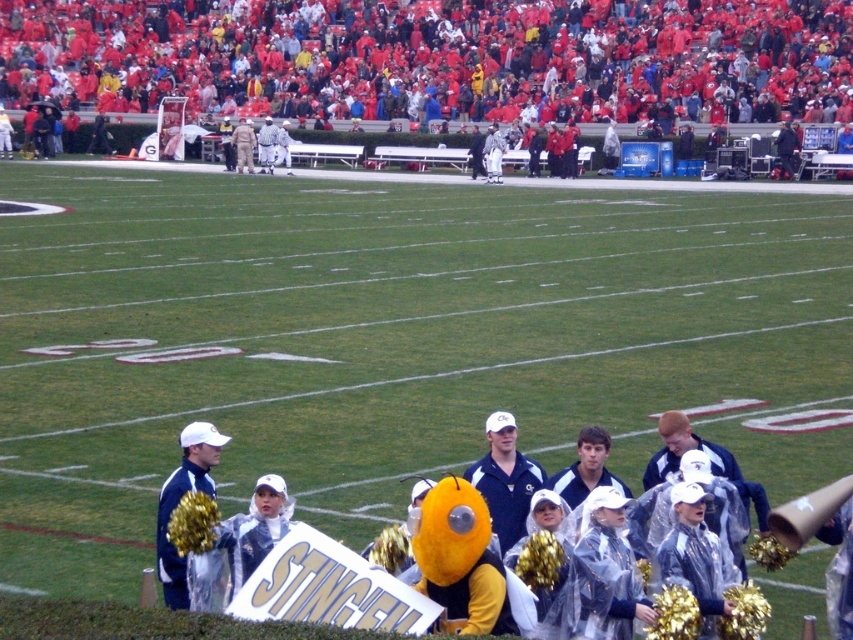
You are an event organizer planning to place a large banner between the red fabric crowd at upper center and the blue fabric jacket at lower left. Which object is wider to determine the banner placement?

The red fabric crowd at upper center might be wider than blue fabric jacket at lower left, so the banner should be placed closer to the red fabric crowd at upper center to ensure it fits properly.

You are a photographer standing at the edge of the football field. You need to capture a photo that includes both the red fabric crowd at upper center and the blue fabric jacket at center. Which object will appear larger in your photo?

The red fabric crowd at upper center will appear larger in the photo because it is bigger than the blue fabric jacket at center.

You are a photographer at the football stadium and want to capture a photo that includes both the red fabric crowd at upper center and the blue fabric jacket at lower left. Based on their positions, where should you position your camera to ensure both are in frame?

To capture both the red fabric crowd at upper center and the blue fabric jacket at lower left in the same frame, position the camera so it is facing upward towards the red fabric crowd at upper center while still capturing the blue fabric jacket at lower left in the lower portion of the frame, since the red fabric crowd at upper center is above the blue fabric jacket at lower left.